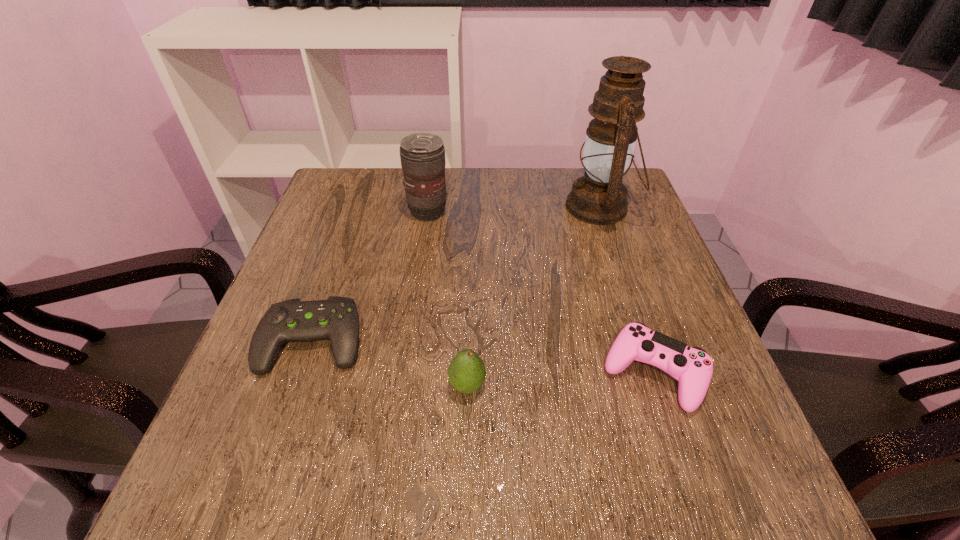
I want to click on empty space that is in between the leftmost object and the third object from right to left, so click(x=390, y=363).

Identify the location of free space between the oil lamp and the shorter control. (456, 274).

I want to click on unoccupied position between the shorter control and the avocado, so click(390, 363).

This screenshot has height=540, width=960. What are the coordinates of `free space between the telephoto lens and the third shortest object` in the screenshot? It's located at (447, 299).

Where is `unoccupied position between the tallest object and the second shortest object`? This screenshot has width=960, height=540. unoccupied position between the tallest object and the second shortest object is located at coordinates (627, 291).

Image resolution: width=960 pixels, height=540 pixels. I want to click on vacant space that's between the second object from left to right and the second shortest object, so click(x=540, y=293).

Locate which object ranks in proximity to the taller control. Please provide its 2D coordinates. Your answer should be formatted as a tuple, i.e. [(x, y)], where the tuple contains the x and y coordinates of a point satisfying the conditions above.

[(466, 373)]

The width and height of the screenshot is (960, 540). Identify the location of the closest object to the tallest object. (422, 155).

This screenshot has height=540, width=960. In order to click on blank space that satisfies the following two spatial constraints: 1. on the side of the telephoto lens where the control switches are located; 2. on the left side of the third shortest object in this screenshot , I will do `click(403, 386)`.

Locate an element on the screen. Image resolution: width=960 pixels, height=540 pixels. vacant point that satisfies the following two spatial constraints: 1. on the front side of the third shortest object; 2. on the left side of the left control is located at coordinates (298, 386).